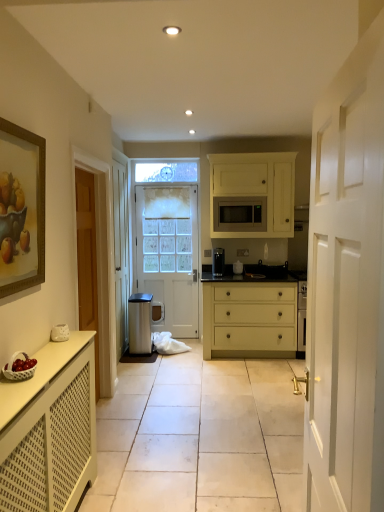
Question: Is white matte cabinet at lower left, positioned as the 1th cabinetry in bottom-to-top order, taller than black matte stove at center, the second appliance positioned from the left?

Choices:
 (A) no
 (B) yes

Answer: (B)

Question: Considering the relative sizes of white matte cabinet at lower left, positioned as the first cabinetry in front-to-back order, and black matte stove at center, the second appliance positioned from the left, in the image provided, is white matte cabinet at lower left, positioned as the first cabinetry in front-to-back order, thinner than black matte stove at center, the second appliance positioned from the left,?

Choices:
 (A) yes
 (B) no

Answer: (A)

Question: Is white matte cabinet at lower left, acting as the first cabinetry starting from the left, in contact with black matte stove at center, which is the 1th appliance in right-to-left order?

Choices:
 (A) no
 (B) yes

Answer: (A)

Question: Does white matte cabinet at lower left, placed as the second cabinetry when sorted from right to left, have a smaller size compared to black matte stove at center, which is the 1th appliance in right-to-left order?

Choices:
 (A) no
 (B) yes

Answer: (A)

Question: Is white matte cabinet at lower left, positioned as the second cabinetry in back-to-front order, to the left of black matte stove at center, which is the 1th appliance in right-to-left order, from the viewer's perspective?

Choices:
 (A) no
 (B) yes

Answer: (B)

Question: Is white matte cabinet at lower left, placed as the second cabinetry when sorted from right to left, not within black matte stove at center, the second appliance positioned from the left?

Choices:
 (A) no
 (B) yes

Answer: (B)

Question: Is white glossy door at right, which is the second door from back to front, next to satin silver microwave at center?

Choices:
 (A) no
 (B) yes

Answer: (A)

Question: Considering the relative sizes of white glossy door at right, the 1th door in the right-to-left sequence, and satin silver microwave at center in the image provided, is white glossy door at right, the 1th door in the right-to-left sequence, taller than satin silver microwave at center?

Choices:
 (A) no
 (B) yes

Answer: (B)

Question: Is white glossy door at right, which is counted as the second door, starting from the left, outside of satin silver microwave at center?

Choices:
 (A) no
 (B) yes

Answer: (B)

Question: Is white glossy door at right, which is the second door from back to front, at the left side of satin silver microwave at center?

Choices:
 (A) yes
 (B) no

Answer: (A)

Question: From a real-world perspective, does white glossy door at right, the 1th door in the right-to-left sequence, sit lower than satin silver microwave at center?

Choices:
 (A) yes
 (B) no

Answer: (A)

Question: Is white glossy door at right, which is the second door from back to front, positioned with its back to satin silver microwave at center?

Choices:
 (A) no
 (B) yes

Answer: (A)

Question: Is white matte drawer at center shorter than wooden framed painting at left?

Choices:
 (A) no
 (B) yes

Answer: (A)